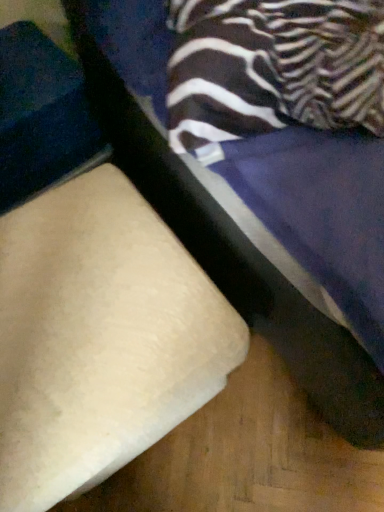
Question: From the image's perspective, is beige fabric ottoman at lower left, which appears as the 2th furniture when viewed from the left, beneath beige fabric cushion at lower left, which is the 1th furniture in left-to-right order?

Choices:
 (A) yes
 (B) no

Answer: (B)

Question: Is the depth of beige fabric ottoman at lower left, the first furniture in the right-to-left sequence, greater than that of beige fabric cushion at lower left, which ranks as the second furniture in right-to-left order?

Choices:
 (A) no
 (B) yes

Answer: (A)

Question: Can you confirm if beige fabric ottoman at lower left, the first furniture in the right-to-left sequence, is taller than beige fabric cushion at lower left, which is the 1th furniture in left-to-right order?

Choices:
 (A) no
 (B) yes

Answer: (B)

Question: From the image's perspective, is beige fabric ottoman at lower left, the first furniture in the right-to-left sequence, on top of beige fabric cushion at lower left, which ranks as the second furniture in right-to-left order?

Choices:
 (A) no
 (B) yes

Answer: (B)

Question: Can you confirm if beige fabric ottoman at lower left, the first furniture in the right-to-left sequence, is positioned to the right of beige fabric cushion at lower left, which is the 1th furniture in left-to-right order?

Choices:
 (A) yes
 (B) no

Answer: (A)

Question: Is beige fabric ottoman at lower left, the first furniture in the right-to-left sequence, aimed at beige fabric cushion at lower left, which ranks as the second furniture in right-to-left order?

Choices:
 (A) no
 (B) yes

Answer: (A)

Question: Is beige fabric cushion at lower left, which is the 1th furniture in left-to-right order, outside beige fabric ottoman at lower left, which appears as the 2th furniture when viewed from the left?

Choices:
 (A) yes
 (B) no

Answer: (A)

Question: From the image's perspective, does beige fabric cushion at lower left, which ranks as the second furniture in right-to-left order, appear lower than beige fabric ottoman at lower left, which appears as the 2th furniture when viewed from the left?

Choices:
 (A) no
 (B) yes

Answer: (B)

Question: Would you say beige fabric cushion at lower left, which is the 1th furniture in left-to-right order, contains beige fabric ottoman at lower left, the first furniture in the right-to-left sequence?

Choices:
 (A) yes
 (B) no

Answer: (B)

Question: Is beige fabric cushion at lower left, which is the 1th furniture in left-to-right order, thinner than beige fabric ottoman at lower left, which appears as the 2th furniture when viewed from the left?

Choices:
 (A) yes
 (B) no

Answer: (A)

Question: Are beige fabric cushion at lower left, which is the 1th furniture in left-to-right order, and beige fabric ottoman at lower left, which appears as the 2th furniture when viewed from the left, located far from each other?

Choices:
 (A) yes
 (B) no

Answer: (B)

Question: Is beige fabric cushion at lower left, which is the 1th furniture in left-to-right order, in front of beige fabric ottoman at lower left, which appears as the 2th furniture when viewed from the left?

Choices:
 (A) yes
 (B) no

Answer: (B)

Question: In terms of size, does beige fabric cushion at lower left, which is the 1th furniture in left-to-right order, appear bigger or smaller than beige fabric ottoman at lower left, which appears as the 2th furniture when viewed from the left?

Choices:
 (A) big
 (B) small

Answer: (B)